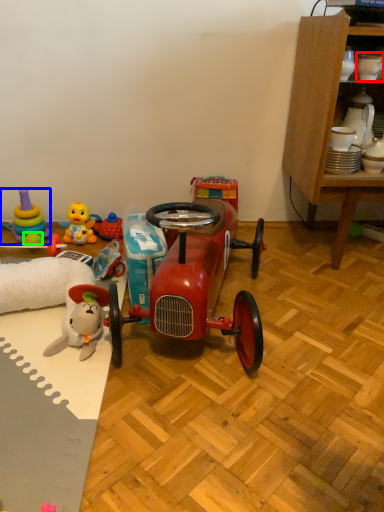
Question: Which object is the closest to the toy (highlighted by a red box)? Choose among these: toy (highlighted by a blue box) or toy (highlighted by a green box).

Choices:
 (A) toy
 (B) toy

Answer: (B)